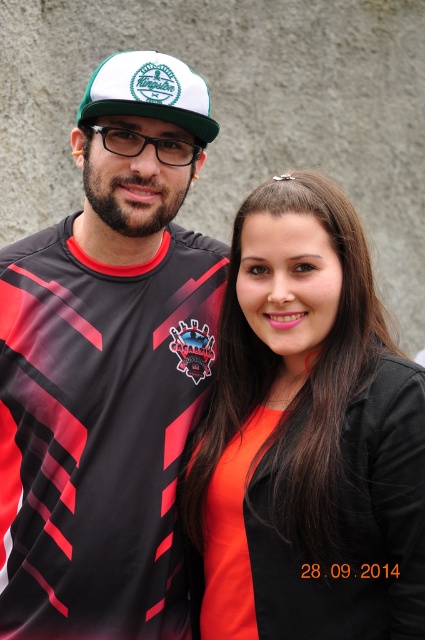
You are a photographer trying to capture a group photo of the matte jersey at center and the orange matte shirt at center. Since both are at the center, how should you arrange them to maintain their original positions as described?

The matte jersey at center should be placed to the left of the orange matte shirt at center to maintain their original positions as described.

You are taking a photo of the matte jersey at center and the white matte baseball cap at upper center. To ensure both are clearly visible, which object should you adjust the focus on first?

The white matte baseball cap at upper center is behind the matte jersey at center, so you should focus on the matte jersey at center first to ensure it is in clear focus before adjusting for the background cap.